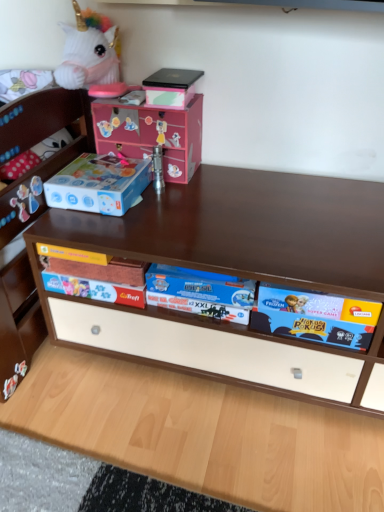
Image resolution: width=384 pixels, height=512 pixels. Find the location of `vacant area that is situated to the right of pink cardboard box at upper center`. vacant area that is situated to the right of pink cardboard box at upper center is located at coordinates (220, 176).